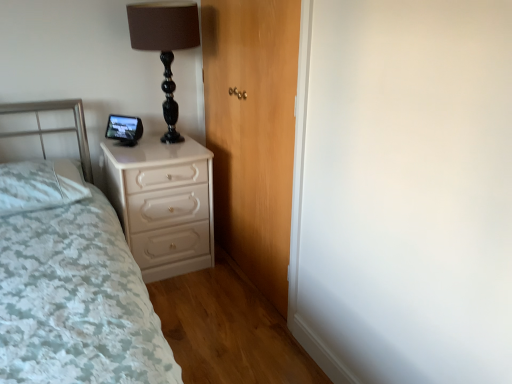
Question: From a real-world perspective, is white glossy chest of drawers at lower left on white soft pillow at left?

Choices:
 (A) no
 (B) yes

Answer: (A)

Question: Is white glossy chest of drawers at lower left wider than white soft pillow at left?

Choices:
 (A) yes
 (B) no

Answer: (A)

Question: Is white glossy chest of drawers at lower left located outside white soft pillow at left?

Choices:
 (A) no
 (B) yes

Answer: (B)

Question: Is white glossy chest of drawers at lower left beside white soft pillow at left?

Choices:
 (A) no
 (B) yes

Answer: (A)

Question: Is white glossy chest of drawers at lower left behind white soft pillow at left?

Choices:
 (A) yes
 (B) no

Answer: (A)

Question: Is wooden door at center in front of or behind white soft pillow at left in the image?

Choices:
 (A) behind
 (B) front

Answer: (B)

Question: From the image's perspective, is wooden door at center positioned above or below white soft pillow at left?

Choices:
 (A) above
 (B) below

Answer: (A)

Question: From their relative heights in the image, would you say wooden door at center is taller or shorter than white soft pillow at left?

Choices:
 (A) tall
 (B) short

Answer: (A)

Question: In the image, is wooden door at center on the left side or the right side of white soft pillow at left?

Choices:
 (A) right
 (B) left

Answer: (A)

Question: Looking at their shapes, would you say wooden door at center is wider or thinner than white textured bed at left?

Choices:
 (A) wide
 (B) thin

Answer: (B)

Question: From a real-world perspective, relative to white textured bed at left, is wooden door at center vertically above or below?

Choices:
 (A) above
 (B) below

Answer: (A)

Question: Is wooden door at center inside the boundaries of white textured bed at left, or outside?

Choices:
 (A) outside
 (B) inside

Answer: (A)

Question: In the image, is wooden door at center on the left side or the right side of white textured bed at left?

Choices:
 (A) left
 (B) right

Answer: (B)

Question: Is black glossy table lamp at upper center in front of or behind white glossy chest of drawers at lower left in the image?

Choices:
 (A) behind
 (B) front

Answer: (B)

Question: In terms of width, does black glossy table lamp at upper center look wider or thinner when compared to white glossy chest of drawers at lower left?

Choices:
 (A) wide
 (B) thin

Answer: (B)